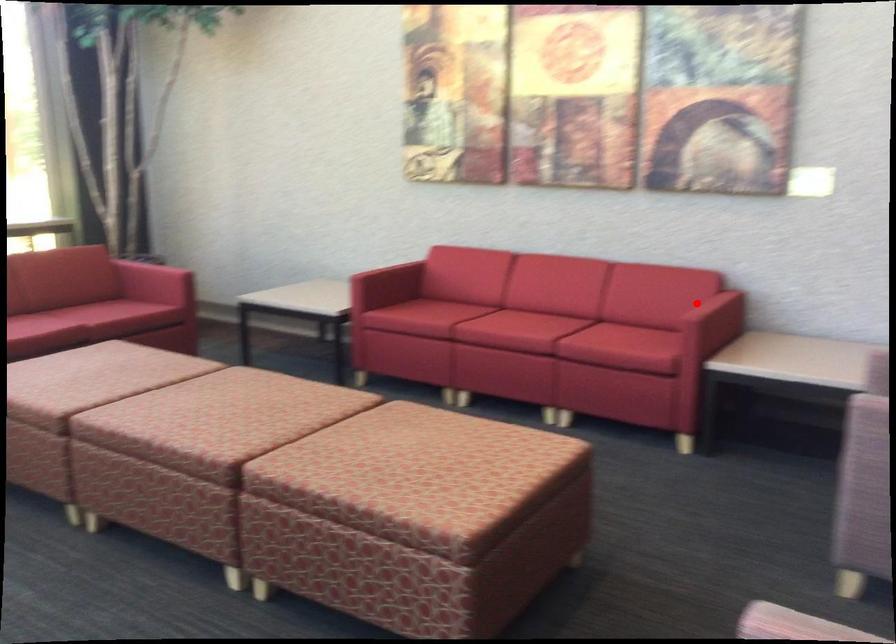
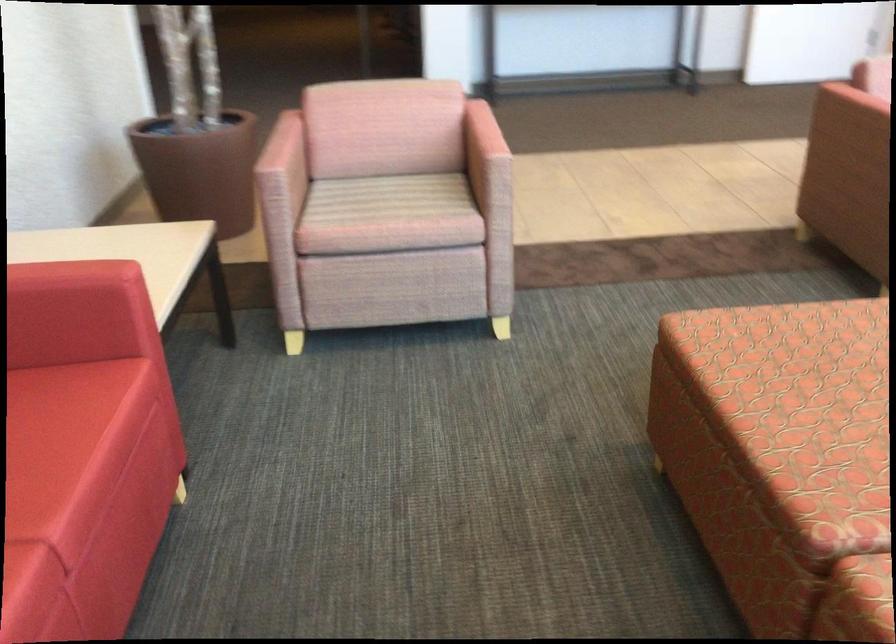
Find the pixel in the second image that matches the highlighted location in the first image.

(76, 272)